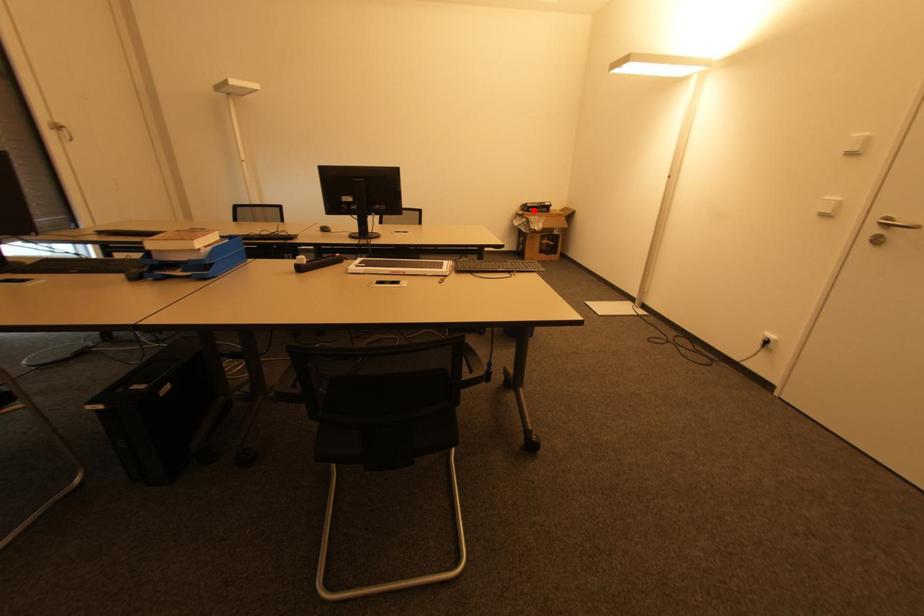
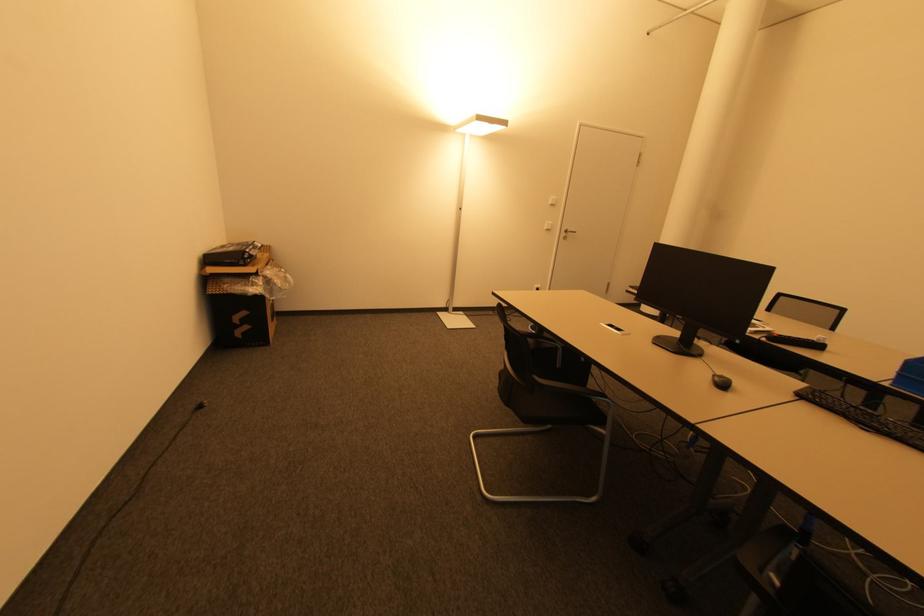
Question: I am providing you with two images of the same scene from different viewpoints. A red point is shown in image1. For the corresponding object point in image2, is it positioned nearer or farther from the camera?

Choices:
 (A) Nearer
 (B) Farther

Answer: (B)